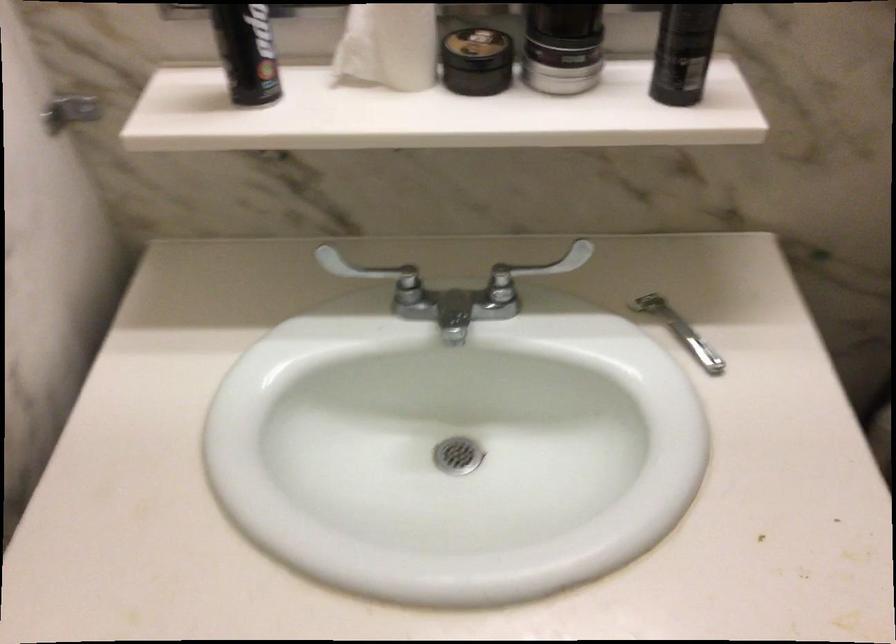
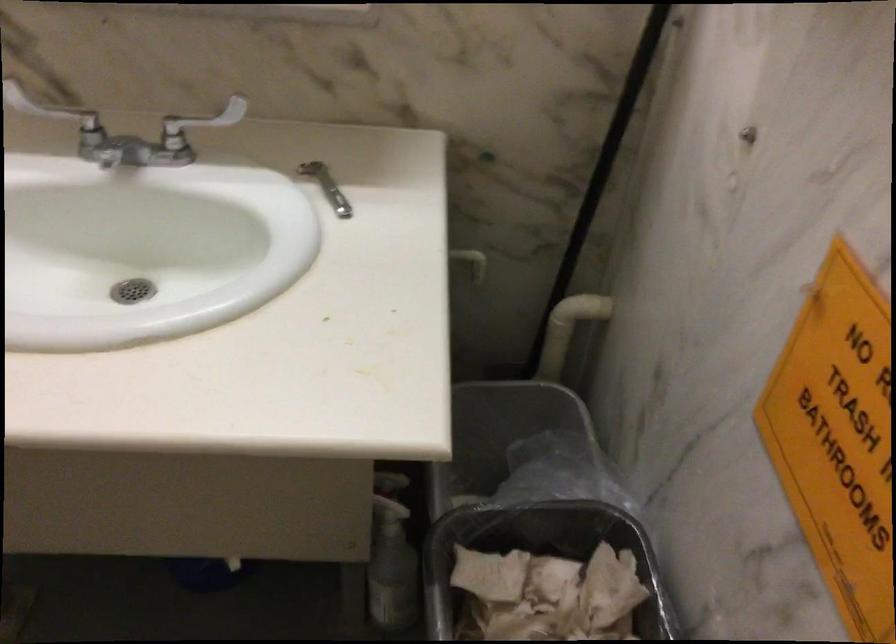
The images are taken continuously from a first-person perspective. In which direction are you moving?

The movement direction of the cameraman is right, backward.